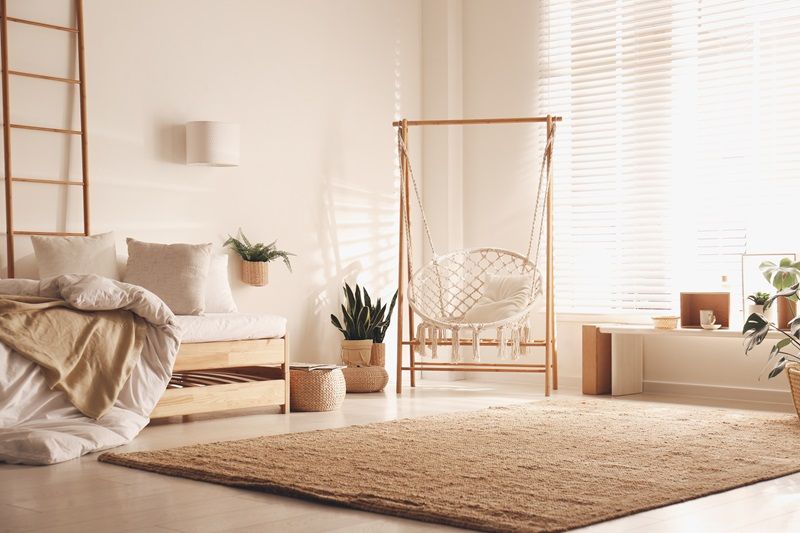
Find the location of a particular element. Image resolution: width=800 pixels, height=533 pixels. rungs is located at coordinates (28, 232), (30, 177), (45, 127), (40, 78), (46, 21).